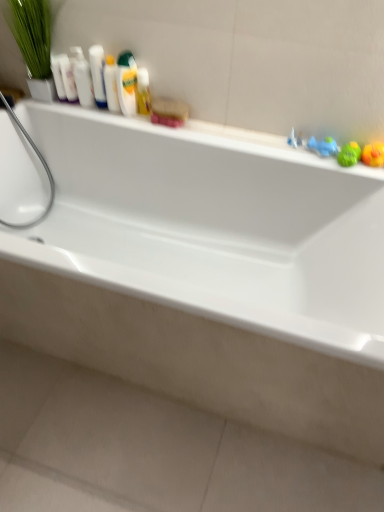
The height and width of the screenshot is (512, 384). In order to click on vacant space that is in between white plastic faucet at upper right and translucent plastic mouthwash at upper center, placed as the 6th mouthwash when sorted from left to right in this screenshot , I will do `click(241, 131)`.